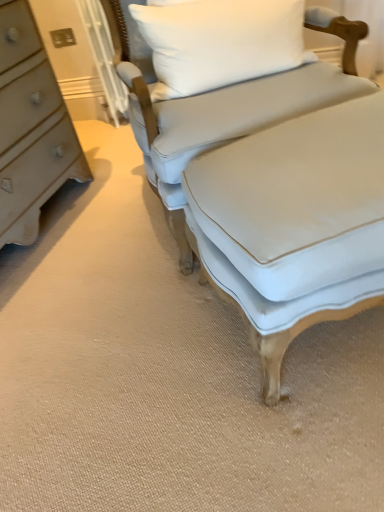
What is the approximate width of light blue fabric ottoman at center?

light blue fabric ottoman at center is 20.70 inches in width.

Describe the element at coordinates (221, 42) in the screenshot. The image size is (384, 512). I see `white fabric pillow at upper center` at that location.

This screenshot has height=512, width=384. Find the location of `light blue fabric couch at center`. light blue fabric couch at center is located at coordinates (227, 102).

Which object is closer to the camera, white fabric pillow at upper center or light blue fabric couch at center?

light blue fabric couch at center.

Is point (158, 74) positioned after point (179, 151)?

Yes, it is behind point (179, 151).

Can you confirm if white fabric pillow at upper center is smaller than light blue fabric couch at center?

Indeed, white fabric pillow at upper center has a smaller size compared to light blue fabric couch at center.

From the image's perspective, does white fabric pillow at upper center appear higher than light blue fabric couch at center?

Indeed, from the image's perspective, white fabric pillow at upper center is shown above light blue fabric couch at center.

How different are the orientations of light blue fabric couch at center and light blue fabric ottoman at center in degrees?

The angular difference between light blue fabric couch at center and light blue fabric ottoman at center is 177 degrees.

Identify the location of studio couch lying on the left of light blue fabric ottoman at center. The image size is (384, 512). (227, 102).

Considering the points (338, 76) and (194, 200), which point is behind, point (338, 76) or point (194, 200)?

The point (338, 76) is behind.

From a real-world perspective, who is located lower, light blue fabric couch at center or light blue fabric ottoman at center?

light blue fabric ottoman at center is physically lower.

Is light blue fabric couch at center far from white fabric pillow at upper center?

They are positioned close to each other.

Is light blue fabric couch at center oriented towards white fabric pillow at upper center?

Yes, light blue fabric couch at center is facing white fabric pillow at upper center.

How far apart are light blue fabric couch at center and white fabric pillow at upper center?

They are 5.56 inches apart.

Looking at this image, can you tell me how much light blue fabric couch at center and white fabric pillow at upper center differ in facing direction?

3.82 degrees.

Can you confirm if light blue fabric ottoman at center is positioned to the left of light blue fabric couch at center?

No, light blue fabric ottoman at center is not to the left of light blue fabric couch at center.

Where is `sheet that is under the light blue fabric couch at center (from a real-world perspective)`? The width and height of the screenshot is (384, 512). sheet that is under the light blue fabric couch at center (from a real-world perspective) is located at coordinates pyautogui.click(x=297, y=199).

Considering the positions of objects light blue fabric ottoman at center and light blue fabric couch at center in the image provided, who is in front, light blue fabric ottoman at center or light blue fabric couch at center?

light blue fabric ottoman at center is in front.

Which is correct: light blue fabric ottoman at center is inside light blue fabric couch at center, or outside of it?

light blue fabric ottoman at center exists outside the volume of light blue fabric couch at center.

Is white fabric pillow at upper center taller than light blue fabric ottoman at center?

No.

From the image's perspective, which one is positioned lower, white fabric pillow at upper center or light blue fabric ottoman at center?

light blue fabric ottoman at center, from the image's perspective.

You are a GUI agent. You are given a task and a screenshot of the screen. Output one action in this format:
    pyautogui.click(x=<x>, y=<y>)
    Task: Click on the sheet below the white fabric pillow at upper center (from a real-world perspective)
    This screenshot has height=512, width=384.
    Given the screenshot: What is the action you would take?
    (297, 199)

Considering the positions of point (240, 14) and point (319, 201), is point (240, 14) closer or farther from the camera than point (319, 201)?

Point (240, 14).

Considering the sizes of objects light blue fabric ottoman at center and white fabric pillow at upper center in the image provided, who is taller, light blue fabric ottoman at center or white fabric pillow at upper center?

With more height is light blue fabric ottoman at center.

The image size is (384, 512). In order to click on sheet that is in front of the white fabric pillow at upper center in this screenshot , I will do `click(297, 199)`.

From a real-world perspective, is light blue fabric ottoman at center above or below white fabric pillow at upper center?

From a real-world perspective, light blue fabric ottoman at center is physically below white fabric pillow at upper center.

Where is `studio couch below the white fabric pillow at upper center (from a real-world perspective)`? studio couch below the white fabric pillow at upper center (from a real-world perspective) is located at coordinates pyautogui.click(x=227, y=102).

You are a GUI agent. You are given a task and a screenshot of the screen. Output one action in this format:
    pyautogui.click(x=<x>, y=<y>)
    Task: Click on the sheet below the light blue fabric couch at center (from the image's perspective)
    
    Given the screenshot: What is the action you would take?
    pyautogui.click(x=297, y=199)

Looking at the image, which one is located closer to white fabric pillow at upper center, light blue fabric ottoman at center or light blue fabric couch at center?

light blue fabric couch at center lies closer to white fabric pillow at upper center than the other object.

From the image, which object appears to be farther from light blue fabric ottoman at center, white fabric pillow at upper center or light blue fabric couch at center?

white fabric pillow at upper center is positioned further to the anchor light blue fabric ottoman at center.

Considering their positions, is light blue fabric couch at center positioned closer to white fabric pillow at upper center than light blue fabric ottoman at center?

light blue fabric couch at center lies closer to white fabric pillow at upper center than the other object.

Which object lies further to the anchor point light blue fabric couch at center, light blue fabric ottoman at center or white fabric pillow at upper center?

light blue fabric ottoman at center is further to light blue fabric couch at center.

Which object lies further to the anchor point light blue fabric ottoman at center, light blue fabric couch at center or white fabric pillow at upper center?

The object further to light blue fabric ottoman at center is white fabric pillow at upper center.

Consider the image. Which object lies nearer to the anchor point light blue fabric couch at center, white fabric pillow at upper center or light blue fabric ottoman at center?

The object closer to light blue fabric couch at center is white fabric pillow at upper center.

Find the location of a particular element. The height and width of the screenshot is (512, 384). studio couch between white fabric pillow at upper center and light blue fabric ottoman at center vertically is located at coordinates (227, 102).